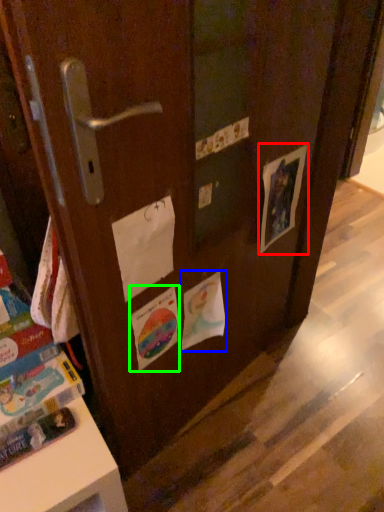
Question: Estimate the real-world distances between objects in this image. Which object is closer to flyer (highlighted by a red box), flyer (highlighted by a blue box) or flyer (highlighted by a green box)?

Choices:
 (A) flyer
 (B) flyer

Answer: (A)